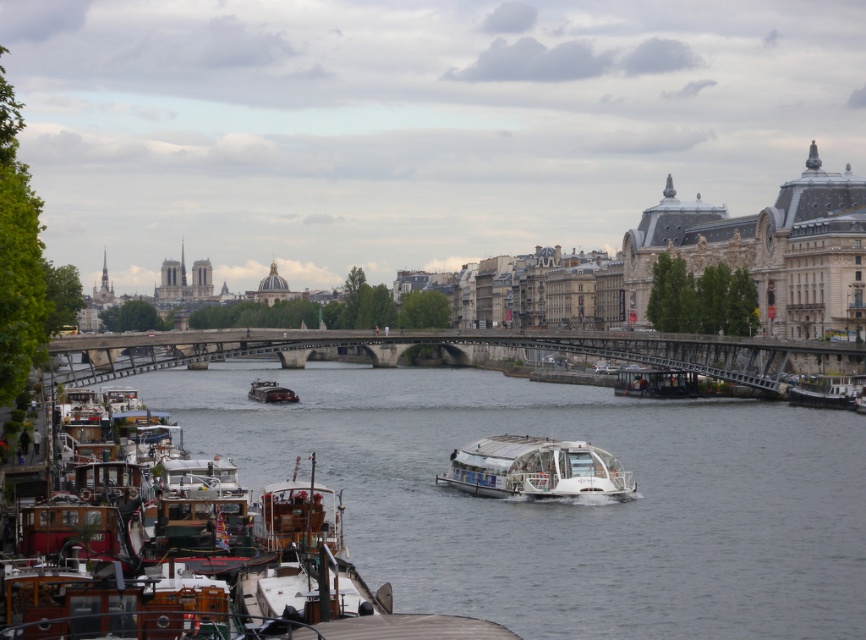
You are a tour guide leading a group along the Seine River. You notice a white glossy boat at lower center and a wooden boat at right. Which boat would you recommend your group to board for a more spacious experience?

The white glossy boat at lower center has a larger size compared to wooden boat at right, so it would provide a more spacious experience for the group.

You are a tourist standing on the bank of the Seine River in Paris and want to cross to the other side. The concrete bridge at center is the only bridge available. Can you use it to cross the river?

Yes, the concrete bridge at center spans across the river, so you can use it to cross to the other side.

You are standing on the riverbank and want to cross to the other side. The concrete bridge at center and the shiny dark brown boat at center are both in your path. Which one is closer to you?

The concrete bridge at center is closer to the viewer than the shiny dark brown boat at center, so the bridge is closer.